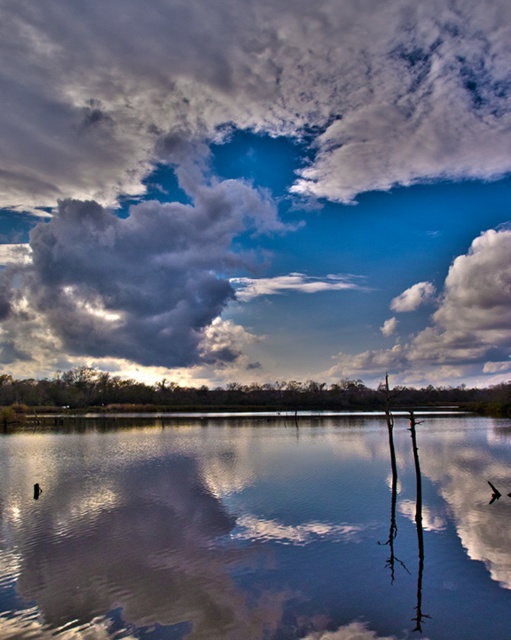
Question: Among these objects, which one is farthest from the camera?

Choices:
 (A) cloudy sky at upper center
 (B) smooth reflective water at center

Answer: (A)

Question: From the image, what is the correct spatial relationship of cloudy sky at upper center in relation to smooth reflective water at center?

Choices:
 (A) left
 (B) right

Answer: (A)

Question: Is cloudy sky at upper center to the left of smooth reflective water at center from the viewer's perspective?

Choices:
 (A) yes
 (B) no

Answer: (A)

Question: Which point is closer to the camera?

Choices:
 (A) (347, 289)
 (B) (184, 513)

Answer: (B)

Question: Where is cloudy sky at upper center located in relation to smooth reflective water at center in the image?

Choices:
 (A) left
 (B) right

Answer: (A)